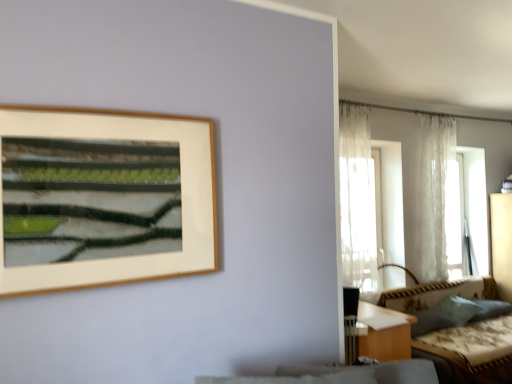
From the picture: What is the approximate height of white sheer curtain at upper right, the 1th curtain positioned from the right?

It is 1.75 meters.

This screenshot has height=384, width=512. I want to click on white sheer curtain at upper right, the 1th curtain in the back-to-front sequence, so click(x=434, y=193).

I want to click on sheer white curtain at right, placed as the second curtain when sorted from right to left, so click(358, 202).

Describe the element at coordinates (467, 213) in the screenshot. I see `translucent fabric window at right` at that location.

Measure the distance between textured beige couch at lower right and camera.

textured beige couch at lower right and camera are 3.06 meters apart from each other.

The image size is (512, 384). In order to click on white sheer curtain at upper right, the 1th curtain in the back-to-front sequence in this screenshot , I will do `click(434, 193)`.

Considering the positions of point (458, 306) and point (431, 125), is point (458, 306) closer or farther from the camera than point (431, 125)?

Point (458, 306) appears to be closer to the viewer than point (431, 125).

Consider the image. Does green fabric pillow at lower right have a greater height compared to white sheer curtain at upper right, the 1th curtain in the back-to-front sequence?

Incorrect, the height of green fabric pillow at lower right is not larger of that of white sheer curtain at upper right, the 1th curtain in the back-to-front sequence.

Is white sheer curtain at upper right, the second curtain when ordered from left to right, at the back of green fabric pillow at lower right?

green fabric pillow at lower right is not turned away from white sheer curtain at upper right, the second curtain when ordered from left to right.

In the image, is green fabric pillow at lower right positioned in front of or behind white sheer curtain at upper right, the second curtain when ordered from left to right?

In the image, green fabric pillow at lower right appears in front of white sheer curtain at upper right, the second curtain when ordered from left to right.

Identify the location of curtain that is the 2nd one above the translucent fabric window at right (from a real-world perspective). (434, 193).

Between white sheer curtain at upper right, which is the second curtain in front-to-back order, and translucent fabric window at right, which one is positioned behind?

translucent fabric window at right is further from the camera.

In terms of height, does white sheer curtain at upper right, the second curtain when ordered from left to right, look taller or shorter compared to translucent fabric window at right?

Clearly, white sheer curtain at upper right, the second curtain when ordered from left to right, is taller compared to translucent fabric window at right.

Would you say white sheer curtain at upper right, the second curtain when ordered from left to right, is outside translucent fabric window at right?

Yes, white sheer curtain at upper right, the second curtain when ordered from left to right, is outside of translucent fabric window at right.

Considering the relative sizes of sheer white curtain at right, which is the first curtain in left-to-right order, and textured beige couch at lower right in the image provided, is sheer white curtain at right, which is the first curtain in left-to-right order, smaller than textured beige couch at lower right?

Yes.

Considering the relative sizes of sheer white curtain at right, which ranks as the second curtain in back-to-front order, and textured beige couch at lower right in the image provided, is sheer white curtain at right, which ranks as the second curtain in back-to-front order, taller than textured beige couch at lower right?

Indeed, sheer white curtain at right, which ranks as the second curtain in back-to-front order, has a greater height compared to textured beige couch at lower right.

Based on the photo, is the position of sheer white curtain at right, which is counted as the first curtain, starting from the front, more distant than that of textured beige couch at lower right?

Yes, sheer white curtain at right, which is counted as the first curtain, starting from the front, is further from the camera.

Is point (368, 155) positioned in front of point (473, 374)?

No, it is not.

Looking at their sizes, would you say translucent fabric window at right is wider or thinner than white sheer curtain at upper right, the 1th curtain in the back-to-front sequence?

Clearly, translucent fabric window at right has more width compared to white sheer curtain at upper right, the 1th curtain in the back-to-front sequence.

From the picture: From a real-world perspective, between translucent fabric window at right and white sheer curtain at upper right, the second curtain when ordered from left to right, who is vertically higher?

white sheer curtain at upper right, the second curtain when ordered from left to right, from a real-world perspective.

From a real-world perspective, is white sheer curtain at upper right, the 1th curtain in the back-to-front sequence, positioned under textured beige couch at lower right based on gravity?

Actually, white sheer curtain at upper right, the 1th curtain in the back-to-front sequence, is physically above textured beige couch at lower right in the real world.

Considering the positions of point (455, 128) and point (450, 348), is point (455, 128) closer or farther from the camera than point (450, 348)?

Point (455, 128) appears to be farther away from the viewer than point (450, 348).

This screenshot has height=384, width=512. Find the location of `the 1st curtain to the left when counting from the textured beige couch at lower right`. the 1st curtain to the left when counting from the textured beige couch at lower right is located at coordinates (434, 193).

What's the angular difference between white sheer curtain at upper right, the 1th curtain in the back-to-front sequence, and textured beige couch at lower right's facing directions?

The facing directions of white sheer curtain at upper right, the 1th curtain in the back-to-front sequence, and textured beige couch at lower right are 2.18 degrees apart.

Are textured beige couch at lower right and white sheer curtain at upper right, the 1th curtain positioned from the right, making contact?

No, textured beige couch at lower right is not in contact with white sheer curtain at upper right, the 1th curtain positioned from the right.

Looking at this image, considering the sizes of textured beige couch at lower right and white sheer curtain at upper right, the 1th curtain positioned from the right, in the image, is textured beige couch at lower right taller or shorter than white sheer curtain at upper right, the 1th curtain positioned from the right,?

In the image, textured beige couch at lower right appears to be shorter than white sheer curtain at upper right, the 1th curtain positioned from the right.

Is textured beige couch at lower right oriented away from white sheer curtain at upper right, the 1th curtain positioned from the right?

textured beige couch at lower right does not have its back to white sheer curtain at upper right, the 1th curtain positioned from the right.

From a real-world perspective, does textured beige couch at lower right sit lower than white sheer curtain at upper right, the 1th curtain in the back-to-front sequence?

Yes, from a real-world perspective, textured beige couch at lower right is below white sheer curtain at upper right, the 1th curtain in the back-to-front sequence.

Which of these two, textured beige couch at lower right or sheer white curtain at right, which ranks as the second curtain in back-to-front order, is bigger?

Bigger between the two is textured beige couch at lower right.

Which of these two, textured beige couch at lower right or sheer white curtain at right, which is the first curtain in left-to-right order, is wider?

textured beige couch at lower right is wider.

How much distance is there between textured beige couch at lower right and sheer white curtain at right, placed as the second curtain when sorted from right to left?

textured beige couch at lower right is 35.28 inches from sheer white curtain at right, placed as the second curtain when sorted from right to left.

Is there a large distance between textured beige couch at lower right and sheer white curtain at right, placed as the second curtain when sorted from right to left?

No.

Find the location of `pillow below the white sheer curtain at upper right, the 1th curtain in the back-to-front sequence (from the image's perspective)`. pillow below the white sheer curtain at upper right, the 1th curtain in the back-to-front sequence (from the image's perspective) is located at coordinates (x=457, y=309).

This screenshot has width=512, height=384. Find the location of `window that is behind the white sheer curtain at upper right, the 1th curtain positioned from the right`. window that is behind the white sheer curtain at upper right, the 1th curtain positioned from the right is located at coordinates (467, 213).

From the image, which object appears to be farther from translucent fabric window at right, textured beige couch at lower right or white sheer curtain at upper right, which is the second curtain in front-to-back order?

textured beige couch at lower right is positioned further to the anchor translucent fabric window at right.

Which object lies nearer to the anchor point sheer white curtain at right, which is counted as the first curtain, starting from the front, green fabric pillow at lower right or white sheer curtain at upper right, the second curtain when ordered from left to right?

white sheer curtain at upper right, the second curtain when ordered from left to right, lies closer to sheer white curtain at right, which is counted as the first curtain, starting from the front, than the other object.

When comparing their distances from green fabric pillow at lower right, does sheer white curtain at right, which is counted as the first curtain, starting from the front, or white sheer curtain at upper right, the second curtain when ordered from left to right, seem further?

sheer white curtain at right, which is counted as the first curtain, starting from the front, is positioned further to the anchor green fabric pillow at lower right.

Which object lies further to the anchor point white sheer curtain at upper right, the 1th curtain positioned from the right, translucent fabric window at right or textured beige couch at lower right?

translucent fabric window at right.

Considering their positions, is textured beige couch at lower right positioned further to white sheer curtain at upper right, the 1th curtain in the back-to-front sequence, than translucent fabric window at right?

Among the two, translucent fabric window at right is located further to white sheer curtain at upper right, the 1th curtain in the back-to-front sequence.

Looking at the image, which one is located further to white sheer curtain at upper right, the second curtain when ordered from left to right, sheer white curtain at right, which is the first curtain in left-to-right order, or translucent fabric window at right?

translucent fabric window at right lies further to white sheer curtain at upper right, the second curtain when ordered from left to right, than the other object.

Based on their spatial positions, is textured beige couch at lower right or green fabric pillow at lower right further from white sheer curtain at upper right, the second curtain when ordered from left to right?

The object further to white sheer curtain at upper right, the second curtain when ordered from left to right, is green fabric pillow at lower right.

Based on their spatial positions, is translucent fabric window at right or green fabric pillow at lower right further from textured beige couch at lower right?

translucent fabric window at right is further to textured beige couch at lower right.

Where is `pillow situated between sheer white curtain at right, which is counted as the first curtain, starting from the front, and translucent fabric window at right from left to right`? The width and height of the screenshot is (512, 384). pillow situated between sheer white curtain at right, which is counted as the first curtain, starting from the front, and translucent fabric window at right from left to right is located at coordinates coord(457,309).

I want to click on curtain situated between sheer white curtain at right, which is counted as the first curtain, starting from the front, and translucent fabric window at right from left to right, so 434,193.

The width and height of the screenshot is (512, 384). Find the location of `curtain between sheer white curtain at right, which is the first curtain in left-to-right order, and green fabric pillow at lower right`. curtain between sheer white curtain at right, which is the first curtain in left-to-right order, and green fabric pillow at lower right is located at coordinates (434, 193).

Where is `pillow between white sheer curtain at upper right, the 1th curtain in the back-to-front sequence, and textured beige couch at lower right vertically`? This screenshot has height=384, width=512. pillow between white sheer curtain at upper right, the 1th curtain in the back-to-front sequence, and textured beige couch at lower right vertically is located at coordinates (457, 309).